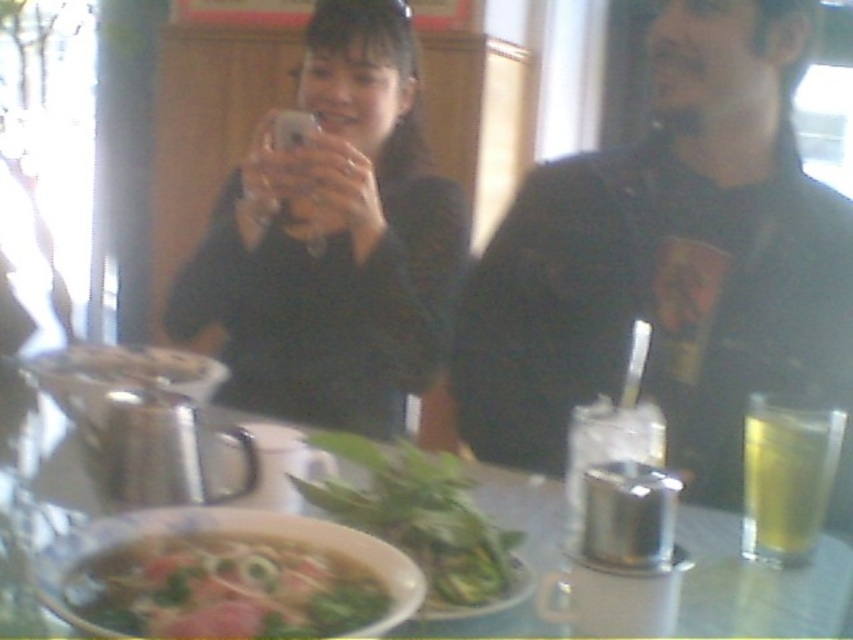
Looking at this image, can you confirm if metallic bowl at center is taller than green leafy vegetable at center?

Correct, metallic bowl at center is much taller as green leafy vegetable at center.

What do you see at coordinates (758, 586) in the screenshot? The height and width of the screenshot is (640, 853). I see `metallic bowl at center` at bounding box center [758, 586].

Where is `metallic bowl at center`? Image resolution: width=853 pixels, height=640 pixels. metallic bowl at center is located at coordinates (758, 586).

Is black matte phone at center below yellow translucent glass at right?

Actually, black matte phone at center is above yellow translucent glass at right.

Is black matte phone at center bigger than yellow translucent glass at right?

Yes, black matte phone at center is bigger than yellow translucent glass at right.

Is point (258, 355) behind point (811, 538)?

Yes, it is behind point (811, 538).

At what (x,y) coordinates should I click in order to perform the action: click on black matte phone at center. Please return your answer as a coordinate pair (x, y). Looking at the image, I should click on (334, 241).

Can you confirm if metallic silver cup at right is bigger than yellow translucent glass at right?

Yes, metallic silver cup at right is bigger than yellow translucent glass at right.

Who is positioned more to the left, metallic silver cup at right or yellow translucent glass at right?

Positioned to the left is metallic silver cup at right.

You are a GUI agent. You are given a task and a screenshot of the screen. Output one action in this format:
    pyautogui.click(x=<x>, y=<y>)
    Task: Click on the metallic silver cup at right
    The height and width of the screenshot is (640, 853).
    Given the screenshot: What is the action you would take?
    pyautogui.click(x=669, y=260)